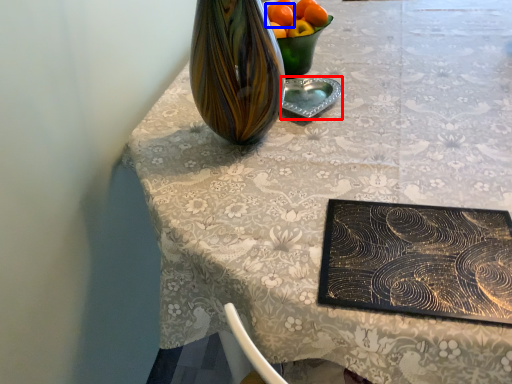
Question: Which point is closer to the camera, tableware (highlighted by a red box) or orange (highlighted by a blue box)?

Choices:
 (A) tableware
 (B) orange

Answer: (A)